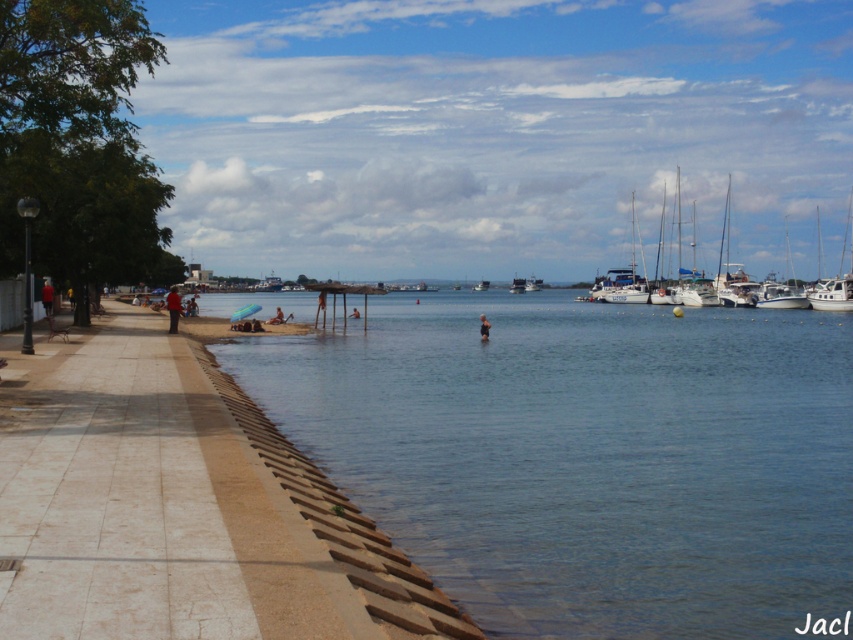
You are a photographer positioned at the center of the walkway. You want to capture a shot of the white glossy sailboat at upper right. Based on the coordinates provided, in which general direction should you point your camera?

The white glossy sailboat at upper right is located at coordinates point (780, 296), which places it in the upper right area of the scene. Therefore, you should point your camera towards the upper right direction to capture the sailboat.

You are standing on the walkway and want to take a photo of the white matte boats at right and the tan skin person at center. Which object is wider in the image?

The white matte boats at right are wider than the tan skin person at center in the image.

You are standing at the center of the walkway in the coastal scene. Looking towards the beach, you notice a point marked at coordinates (677, 216). What object is located at that point?

At point (677, 216) lies white matte boats at right.